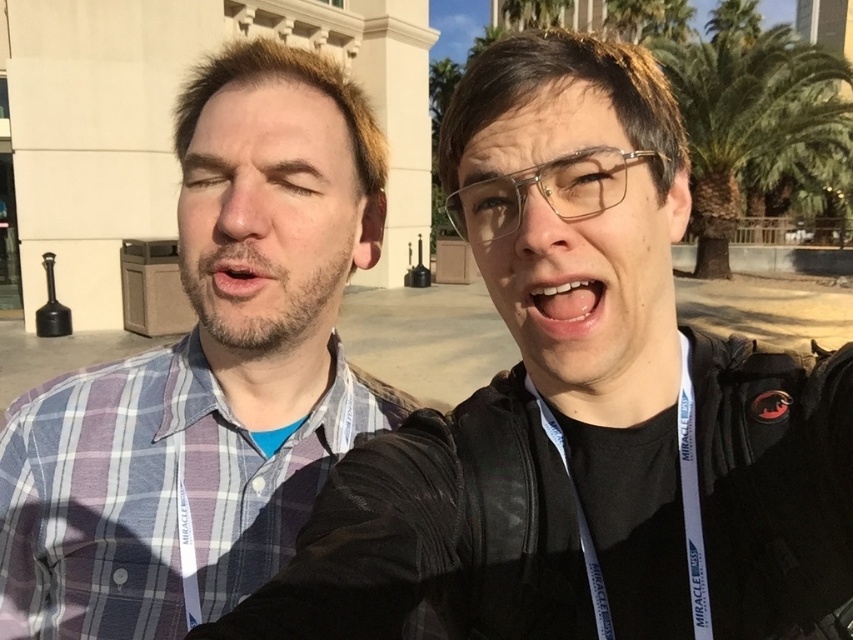
Between blue plaid shirt at center and white glossy teeth at center, which one appears on the right side from the viewer's perspective?

From the viewer's perspective, white glossy teeth at center appears more on the right side.

Is blue plaid shirt at center smaller than white glossy teeth at center?

No, blue plaid shirt at center is not smaller than white glossy teeth at center.

The image size is (853, 640). Find the location of `blue plaid shirt at center`. blue plaid shirt at center is located at coordinates (207, 376).

At what (x,y) coordinates should I click in order to perform the action: click on blue plaid shirt at center. Please return your answer as a coordinate pair (x, y). Looking at the image, I should click on (207, 376).

Who is more distant from viewer, (x=679, y=77) or (x=218, y=282)?

Positioned behind is point (x=679, y=77).

Who is positioned more to the right, green leafy palm tree at upper right or dry skin at center?

green leafy palm tree at upper right is more to the right.

What are the coordinates of `green leafy palm tree at upper right` in the screenshot? It's located at (751, 122).

Is point (524, 330) positioned in front of point (250, 262)?

Yes, it is.

Is white glossy teeth at center closer to camera compared to dry skin at center?

Yes, white glossy teeth at center is in front of dry skin at center.

This screenshot has width=853, height=640. I want to click on white glossy teeth at center, so click(563, 305).